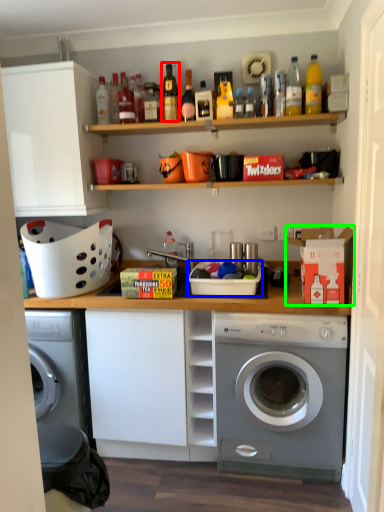
Question: Which is farther away from bottle (highlighted by a red box)? basket (highlighted by a blue box) or cardboard box (highlighted by a green box)?

Choices:
 (A) basket
 (B) cardboard box

Answer: (B)